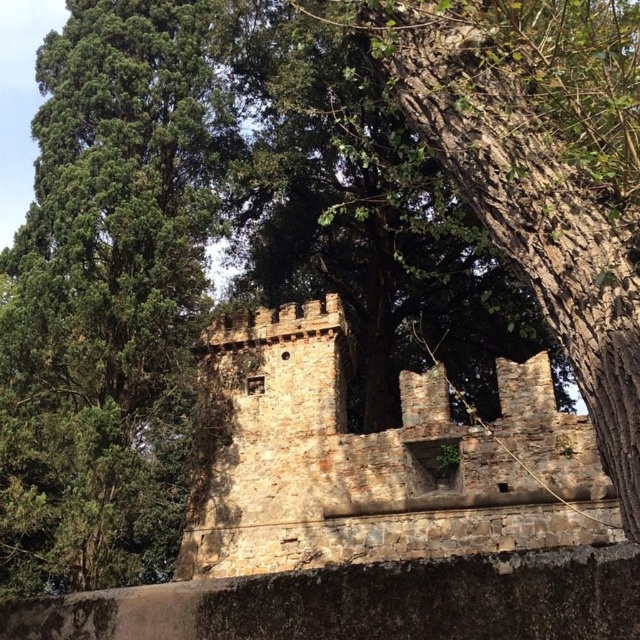
Question: Is green leafy tree at center closer to camera compared to brown stone castle at center?

Choices:
 (A) yes
 (B) no

Answer: (B)

Question: Among these points, which one is farthest from the camera?

Choices:
 (A) (97, 481)
 (B) (298, 490)

Answer: (B)

Question: Among these points, which one is nearest to the camera?

Choices:
 (A) (145, 211)
 (B) (388, 429)

Answer: (A)

Question: Does green leafy tree at center have a larger size compared to brown stone castle at center?

Choices:
 (A) no
 (B) yes

Answer: (B)

Question: Considering the relative positions of green leafy tree at center and brown stone castle at center in the image provided, where is green leafy tree at center located with respect to brown stone castle at center?

Choices:
 (A) below
 (B) above

Answer: (B)